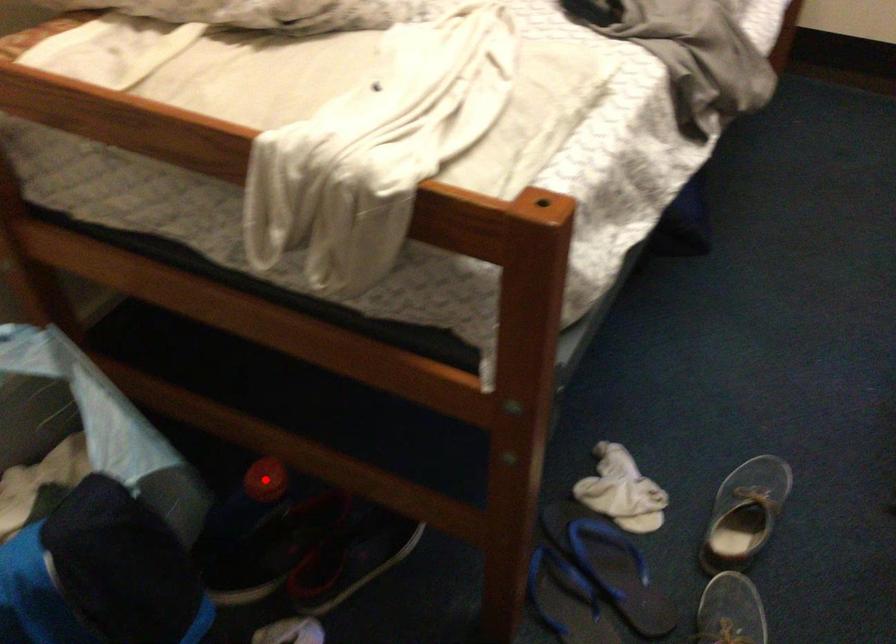
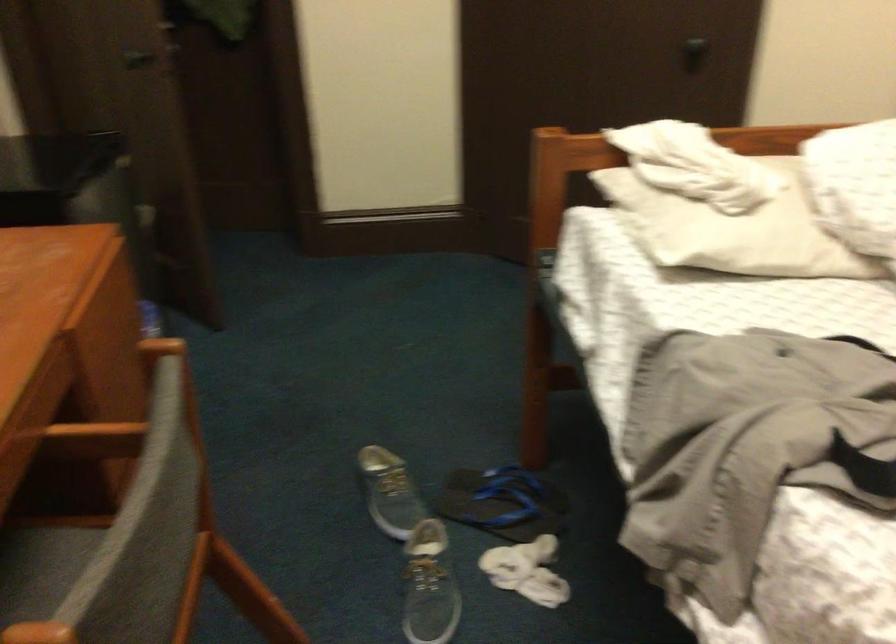
Question: I am providing you with two images of the same scene from different viewpoints. A red point is marked on the first image. At the location where the point appears in image 1, is it still visible in image 2?

Choices:
 (A) Yes
 (B) No

Answer: (B)